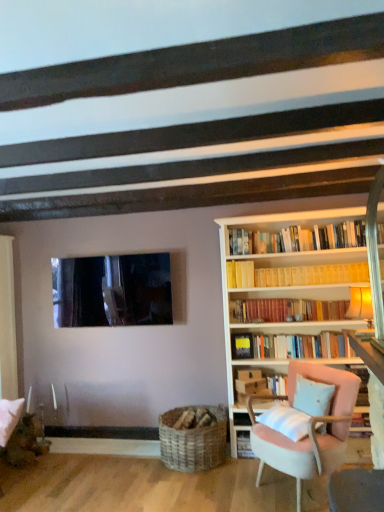
Question: Is pink fabric chair at right bigger than transparent glass window at upper center?

Choices:
 (A) yes
 (B) no

Answer: (A)

Question: Is pink fabric chair at right not inside transparent glass window at upper center?

Choices:
 (A) no
 (B) yes

Answer: (B)

Question: Is pink fabric chair at right beside transparent glass window at upper center?

Choices:
 (A) yes
 (B) no

Answer: (B)

Question: From the image's perspective, is pink fabric chair at right below transparent glass window at upper center?

Choices:
 (A) yes
 (B) no

Answer: (A)

Question: Is the position of pink fabric chair at right more distant than that of transparent glass window at upper center?

Choices:
 (A) no
 (B) yes

Answer: (A)

Question: Does pink fabric chair at right appear on the right side of transparent glass window at upper center?

Choices:
 (A) no
 (B) yes

Answer: (B)

Question: Can you confirm if hardcover books at center, acting as the second book starting from the top, is bigger than yellow paperbacks at upper center, the 2th book ordered from the bottom?

Choices:
 (A) no
 (B) yes

Answer: (B)

Question: Considering the relative sizes of hardcover books at center, placed as the first book when sorted from bottom to top, and yellow paperbacks at upper center, acting as the first book starting from the top, in the image provided, is hardcover books at center, placed as the first book when sorted from bottom to top, taller than yellow paperbacks at upper center, acting as the first book starting from the top,?

Choices:
 (A) no
 (B) yes

Answer: (B)

Question: From a real-world perspective, is hardcover books at center, acting as the second book starting from the top, located beneath yellow paperbacks at upper center, acting as the first book starting from the top?

Choices:
 (A) no
 (B) yes

Answer: (B)

Question: Is hardcover books at center, placed as the first book when sorted from bottom to top, thinner than yellow paperbacks at upper center, the 2th book ordered from the bottom?

Choices:
 (A) no
 (B) yes

Answer: (B)

Question: From the image's perspective, is hardcover books at center, acting as the second book starting from the top, below yellow paperbacks at upper center, the 2th book ordered from the bottom?

Choices:
 (A) yes
 (B) no

Answer: (A)

Question: Is hardcover books at center, placed as the first book when sorted from bottom to top, aimed at yellow paperbacks at upper center, the 2th book ordered from the bottom?

Choices:
 (A) yes
 (B) no

Answer: (B)

Question: Is woven wood basket at lower center facing towards hardcover books at center, acting as the second book starting from the top?

Choices:
 (A) yes
 (B) no

Answer: (B)